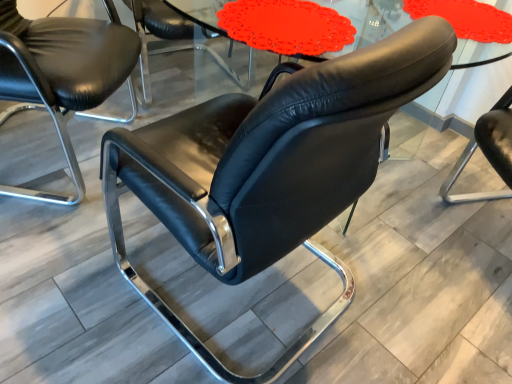
Find the location of a particular element. Image resolution: width=512 pixels, height=384 pixels. vacant region under black leather chair at left, arranged as the second chair when viewed from the back (from a real-world perspective) is located at coordinates (54, 152).